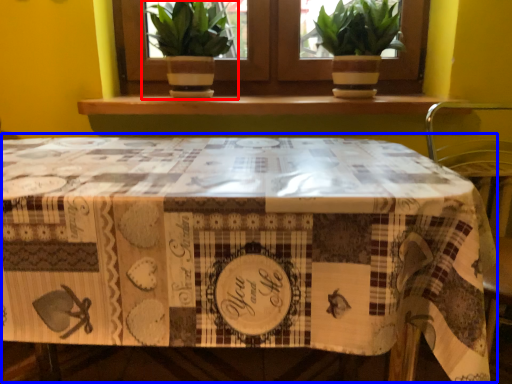
Question: Which object appears closest to the camera in this image, houseplant (highlighted by a red box) or table (highlighted by a blue box)?

Choices:
 (A) houseplant
 (B) table

Answer: (B)